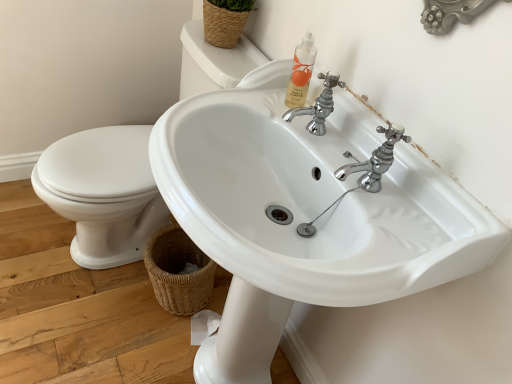
What is the approximate width of white glossy sink at center, the second sink positioned from the left?

white glossy sink at center, the second sink positioned from the left, is 49.27 centimeters in width.

Describe the element at coordinates (178, 271) in the screenshot. I see `brown woven basket at lower left, the 2th basket positioned from the top` at that location.

What do you see at coordinates (103, 193) in the screenshot? I see `white glossy sink at center, arranged as the second sink when viewed from the right` at bounding box center [103, 193].

You are a GUI agent. You are given a task and a screenshot of the screen. Output one action in this format:
    pyautogui.click(x=<x>, y=<y>)
    Task: Click on the white glossy sink at center, the second sink positioned from the left
    The width and height of the screenshot is (512, 384).
    Given the screenshot: What is the action you would take?
    pyautogui.click(x=312, y=200)

Can you confirm if white glossy sink at center, the second sink positioned from the left, is positioned to the right of brown woven basket at lower left, the 2th basket positioned from the top?

Yes, white glossy sink at center, the second sink positioned from the left, is to the right of brown woven basket at lower left, the 2th basket positioned from the top.

Is brown woven basket at lower left, positioned as the first basket in bottom-to-top order, at the back of white glossy sink at center, positioned as the first sink in right-to-left order?

white glossy sink at center, positioned as the first sink in right-to-left order, does not have its back to brown woven basket at lower left, positioned as the first basket in bottom-to-top order.

Can you see white glossy sink at center, positioned as the first sink in right-to-left order, touching brown woven basket at lower left, positioned as the first basket in bottom-to-top order?

No, white glossy sink at center, positioned as the first sink in right-to-left order, is not in contact with brown woven basket at lower left, positioned as the first basket in bottom-to-top order.

The image size is (512, 384). In order to click on sink that is on the right side of brown woven basket at lower left, positioned as the first basket in bottom-to-top order in this screenshot , I will do `click(312, 200)`.

Is white glossy sink at center, positioned as the first sink in right-to-left order, further to camera compared to white glossy sink at center, which ranks as the 1th sink in left-to-right order?

No, white glossy sink at center, positioned as the first sink in right-to-left order, is closer to the viewer.

Does white glossy sink at center, the second sink positioned from the left, appear on the right side of white glossy sink at center, arranged as the second sink when viewed from the right?

Yes.

Which of these two, white glossy sink at center, positioned as the first sink in right-to-left order, or white glossy sink at center, which ranks as the 1th sink in left-to-right order, is smaller?

With smaller size is white glossy sink at center, which ranks as the 1th sink in left-to-right order.

Measure the distance between white glossy sink at center, the second sink positioned from the left, and white glossy sink at center, arranged as the second sink when viewed from the right.

A distance of 24.31 inches exists between white glossy sink at center, the second sink positioned from the left, and white glossy sink at center, arranged as the second sink when viewed from the right.

From the image's perspective, is white glossy sink at center, which ranks as the 1th sink in left-to-right order, beneath woven straw basket at upper center, the 2th basket in the bottom-to-top sequence?

Correct, white glossy sink at center, which ranks as the 1th sink in left-to-right order, appears lower than woven straw basket at upper center, the 2th basket in the bottom-to-top sequence, in the image.

Looking at this image, considering the sizes of white glossy sink at center, which ranks as the 1th sink in left-to-right order, and woven straw basket at upper center, the 2th basket in the bottom-to-top sequence, in the image, is white glossy sink at center, which ranks as the 1th sink in left-to-right order, wider or thinner than woven straw basket at upper center, the 2th basket in the bottom-to-top sequence,?

white glossy sink at center, which ranks as the 1th sink in left-to-right order, is wider than woven straw basket at upper center, the 2th basket in the bottom-to-top sequence.

What's the angular difference between white glossy sink at center, which ranks as the 1th sink in left-to-right order, and woven straw basket at upper center, the first basket viewed from the top,'s facing directions?

0.944 degrees.

Locate an element on the screen. The image size is (512, 384). sink on the left of woven straw basket at upper center, the 2th basket in the bottom-to-top sequence is located at coordinates (103, 193).

Based on the photo, is brown woven basket at lower left, the 2th basket positioned from the top, placed right next to woven straw basket at upper center, the first basket viewed from the top?

No, brown woven basket at lower left, the 2th basket positioned from the top, is not next to woven straw basket at upper center, the first basket viewed from the top.

Does brown woven basket at lower left, the 2th basket positioned from the top, lie in front of woven straw basket at upper center, the 2th basket in the bottom-to-top sequence?

No, brown woven basket at lower left, the 2th basket positioned from the top, is behind woven straw basket at upper center, the 2th basket in the bottom-to-top sequence.

In the scene shown: Who is shorter, brown woven basket at lower left, the 2th basket positioned from the top, or woven straw basket at upper center, the first basket viewed from the top?

Standing shorter between the two is woven straw basket at upper center, the first basket viewed from the top.

From the image's perspective, is brown woven basket at lower left, the 2th basket positioned from the top, located above woven straw basket at upper center, the first basket viewed from the top?

No, from the image's perspective, brown woven basket at lower left, the 2th basket positioned from the top, is not over woven straw basket at upper center, the first basket viewed from the top.

From a real-world perspective, which is physically above, white glossy sink at center, arranged as the second sink when viewed from the right, or brown woven basket at lower left, the 2th basket positioned from the top?

white glossy sink at center, arranged as the second sink when viewed from the right, is physically above.

In terms of height, does white glossy sink at center, which ranks as the 1th sink in left-to-right order, look taller or shorter compared to brown woven basket at lower left, the 2th basket positioned from the top?

Considering their sizes, white glossy sink at center, which ranks as the 1th sink in left-to-right order, has more height than brown woven basket at lower left, the 2th basket positioned from the top.

Which object is positioned more to the left, white glossy sink at center, which ranks as the 1th sink in left-to-right order, or brown woven basket at lower left, positioned as the first basket in bottom-to-top order?

white glossy sink at center, which ranks as the 1th sink in left-to-right order.

From the image's perspective, between white glossy sink at center, arranged as the second sink when viewed from the right, and brown woven basket at lower left, the 2th basket positioned from the top, who is located below?

brown woven basket at lower left, the 2th basket positioned from the top.

In the image, is white glossy sink at center, arranged as the second sink when viewed from the right, positioned in front of or behind white glossy sink at center, positioned as the first sink in right-to-left order?

white glossy sink at center, arranged as the second sink when viewed from the right, is positioned farther from the viewer than white glossy sink at center, positioned as the first sink in right-to-left order.

Which is less distant, (206, 82) or (213, 122)?

Point (213, 122)

Considering the sizes of white glossy sink at center, which ranks as the 1th sink in left-to-right order, and white glossy sink at center, the second sink positioned from the left, in the image, is white glossy sink at center, which ranks as the 1th sink in left-to-right order, wider or thinner than white glossy sink at center, the second sink positioned from the left,?

Considering their sizes, white glossy sink at center, which ranks as the 1th sink in left-to-right order, looks broader than white glossy sink at center, the second sink positioned from the left.

Is white glossy sink at center, arranged as the second sink when viewed from the right, next to white glossy sink at center, the second sink positioned from the left?

No.

Identify the location of basket that is the 1st one when counting rightward from the white glossy sink at center, arranged as the second sink when viewed from the right. (178, 271).

Is the depth of brown woven basket at lower left, the 2th basket positioned from the top, greater than that of white glossy sink at center, arranged as the second sink when viewed from the right?

Yes, it is behind white glossy sink at center, arranged as the second sink when viewed from the right.

Consider the image. Considering the sizes of objects brown woven basket at lower left, positioned as the first basket in bottom-to-top order, and white glossy sink at center, arranged as the second sink when viewed from the right, in the image provided, who is shorter, brown woven basket at lower left, positioned as the first basket in bottom-to-top order, or white glossy sink at center, arranged as the second sink when viewed from the right,?

Standing shorter between the two is brown woven basket at lower left, positioned as the first basket in bottom-to-top order.

Are brown woven basket at lower left, positioned as the first basket in bottom-to-top order, and white glossy sink at center, which ranks as the 1th sink in left-to-right order, making contact?

No, brown woven basket at lower left, positioned as the first basket in bottom-to-top order, is not next to white glossy sink at center, which ranks as the 1th sink in left-to-right order.

Find the location of a particular element. Image resolution: width=512 pixels, height=384 pixels. the 2nd sink positioned above the brown woven basket at lower left, positioned as the first basket in bottom-to-top order (from a real-world perspective) is located at coordinates (312, 200).

The height and width of the screenshot is (384, 512). Identify the location of sink in front of the white glossy sink at center, arranged as the second sink when viewed from the right. (312, 200).

From the image, which object appears to be farther from woven straw basket at upper center, the first basket viewed from the top, white glossy sink at center, which ranks as the 1th sink in left-to-right order, or white glossy sink at center, the second sink positioned from the left?

white glossy sink at center, the second sink positioned from the left, lies further to woven straw basket at upper center, the first basket viewed from the top, than the other object.

When comparing their distances from brown woven basket at lower left, the 2th basket positioned from the top, does white glossy sink at center, the second sink positioned from the left, or woven straw basket at upper center, the 2th basket in the bottom-to-top sequence, seem closer?

Among the two, white glossy sink at center, the second sink positioned from the left, is located nearer to brown woven basket at lower left, the 2th basket positioned from the top.

Estimate the real-world distances between objects in this image. Which object is closer to brown woven basket at lower left, positioned as the first basket in bottom-to-top order, white glossy sink at center, which ranks as the 1th sink in left-to-right order, or woven straw basket at upper center, the 2th basket in the bottom-to-top sequence?

white glossy sink at center, which ranks as the 1th sink in left-to-right order, is closer to brown woven basket at lower left, positioned as the first basket in bottom-to-top order.

When comparing their distances from woven straw basket at upper center, the first basket viewed from the top, does white glossy sink at center, positioned as the first sink in right-to-left order, or white glossy sink at center, which ranks as the 1th sink in left-to-right order, seem further?

white glossy sink at center, positioned as the first sink in right-to-left order, is further to woven straw basket at upper center, the first basket viewed from the top.

Consider the image. Estimate the real-world distances between objects in this image. Which object is closer to white glossy sink at center, arranged as the second sink when viewed from the right, brown woven basket at lower left, the 2th basket positioned from the top, or woven straw basket at upper center, the first basket viewed from the top?

brown woven basket at lower left, the 2th basket positioned from the top, lies closer to white glossy sink at center, arranged as the second sink when viewed from the right, than the other object.

When comparing their distances from white glossy sink at center, positioned as the first sink in right-to-left order, does brown woven basket at lower left, positioned as the first basket in bottom-to-top order, or woven straw basket at upper center, the 2th basket in the bottom-to-top sequence, seem further?

The object further to white glossy sink at center, positioned as the first sink in right-to-left order, is woven straw basket at upper center, the 2th basket in the bottom-to-top sequence.

Based on their spatial positions, is woven straw basket at upper center, the first basket viewed from the top, or white glossy sink at center, the second sink positioned from the left, closer to white glossy sink at center, which ranks as the 1th sink in left-to-right order?

Among the two, woven straw basket at upper center, the first basket viewed from the top, is located nearer to white glossy sink at center, which ranks as the 1th sink in left-to-right order.

Estimate the real-world distances between objects in this image. Which object is further from brown woven basket at lower left, the 2th basket positioned from the top, woven straw basket at upper center, the 2th basket in the bottom-to-top sequence, or white glossy sink at center, arranged as the second sink when viewed from the right?

The object further to brown woven basket at lower left, the 2th basket positioned from the top, is woven straw basket at upper center, the 2th basket in the bottom-to-top sequence.

At what (x,y) coordinates should I click in order to perform the action: click on sink that lies between woven straw basket at upper center, the first basket viewed from the top, and white glossy sink at center, positioned as the first sink in right-to-left order, from top to bottom. Please return your answer as a coordinate pair (x, y). This screenshot has height=384, width=512. Looking at the image, I should click on (103, 193).

What are the coordinates of `sink located between white glossy sink at center, the second sink positioned from the left, and brown woven basket at lower left, positioned as the first basket in bottom-to-top order, in the depth direction` in the screenshot? It's located at (103, 193).